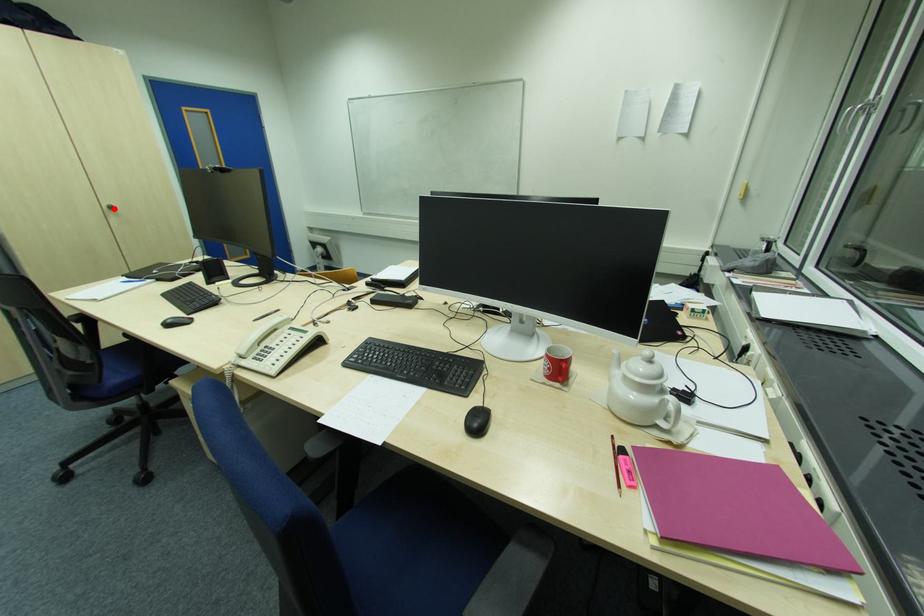
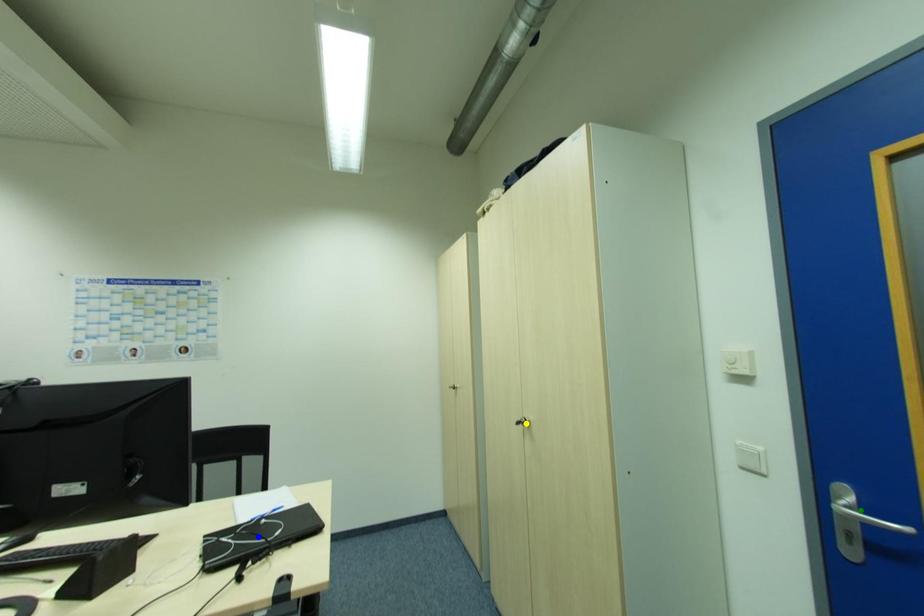
Question: I am providing you with two images of the same scene from different viewpoints. A red point is marked on the first image. You are given multiple points on the second image. Which point in image 2 is actually the same real-world point as the red point in image 1?

Choices:
 (A) green point
 (B) yellow point
 (C) blue point

Answer: (B)